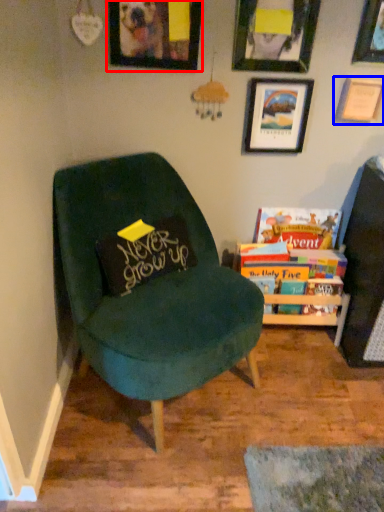
Question: Which of the following is the farthest to the observer, picture frame (highlighted by a red box) or picture frame (highlighted by a blue box)?

Choices:
 (A) picture frame
 (B) picture frame

Answer: (B)